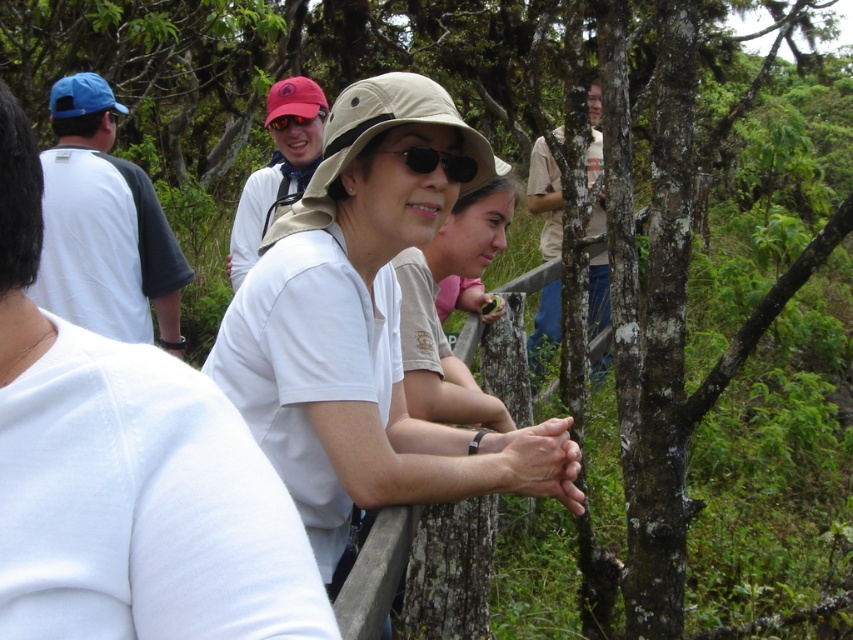
Does white matte hat at center have a lesser width compared to light brown fabric shirt at center?

No.

Between point (337, 196) and point (466, 298), which one is positioned in front?

Point (337, 196) is in front.

Who is more forward, [316,490] or [412,397]?

Point [316,490]

You are a GUI agent. You are given a task and a screenshot of the screen. Output one action in this format:
    pyautogui.click(x=<x>, y=<y>)
    Task: Click on the white matte hat at center
    
    Given the screenshot: What is the action you would take?
    pyautogui.click(x=364, y=330)

Who is more distant from viewer, (136, 264) or (407, 161)?

The point (136, 264) is more distant.

Looking at this image, who is more distant from viewer, (155, 253) or (454, 172)?

The point (155, 253) is behind.

Where is `white cotton shirt at left`? This screenshot has height=640, width=853. white cotton shirt at left is located at coordinates click(103, 227).

Can you confirm if white matte shirt at upper center is thinner than black matte sunglasses at center?

No, white matte shirt at upper center is not thinner than black matte sunglasses at center.

From the picture: Between white matte shirt at upper center and black matte sunglasses at center, which one has more height?

With more height is white matte shirt at upper center.

What are the coordinates of `white matte shirt at upper center` in the screenshot? It's located at (126, 474).